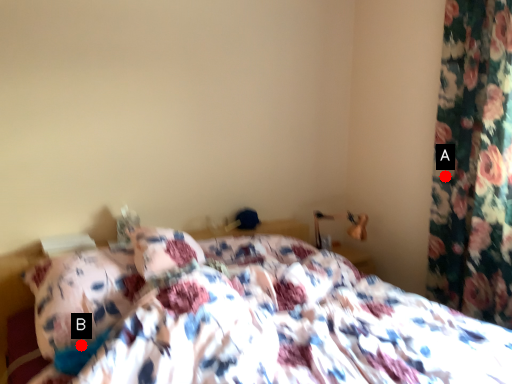
Question: Two points are circled on the image, labeled by A and B beside each circle. Which point is farther to the camera?

Choices:
 (A) A is further
 (B) B is further

Answer: (A)